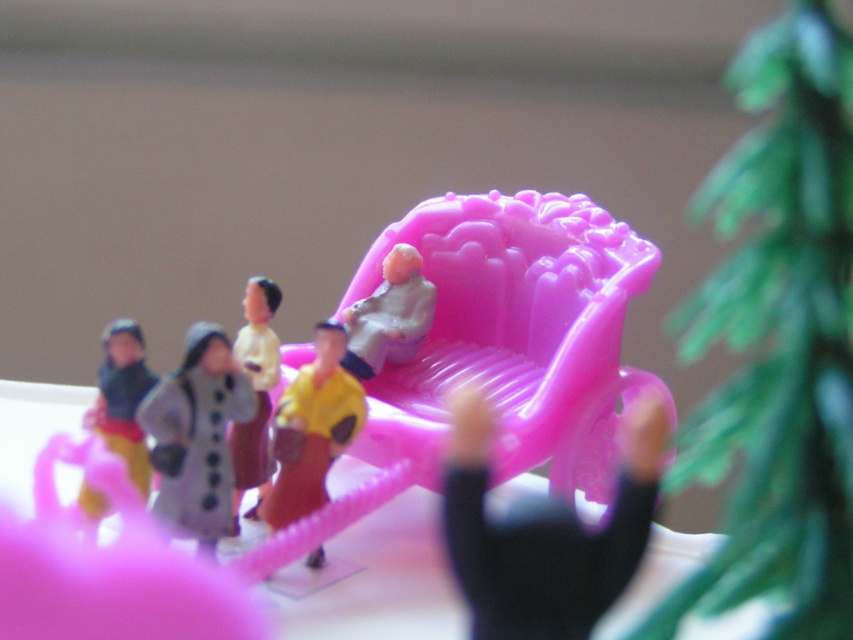
You are looking at the miniature scene with the bright pink toy carriage. There are two points marked in the image. Can you determine which point is closer to you, point (154, 435) or point (135, 458)?

Point (154, 435) is in front of point (135, 458), so it is closer to you.

Based on the photo, you are a miniature collector examining the scene. You see the matte black figurine at left and the yellow matte figure at center. Which one is positioned lower in the image?

The matte black figurine at left is located below the yellow matte figure at center, so it is positioned lower in the image.

You are organizing a miniature toy display and need to place the gray matte coat at center and the matte black figurine at left in a straight line. Which object should be placed first to ensure proper alignment?

The matte black figurine at left should be placed first since the gray matte coat at center is to the right of it, ensuring correct positioning in the line.